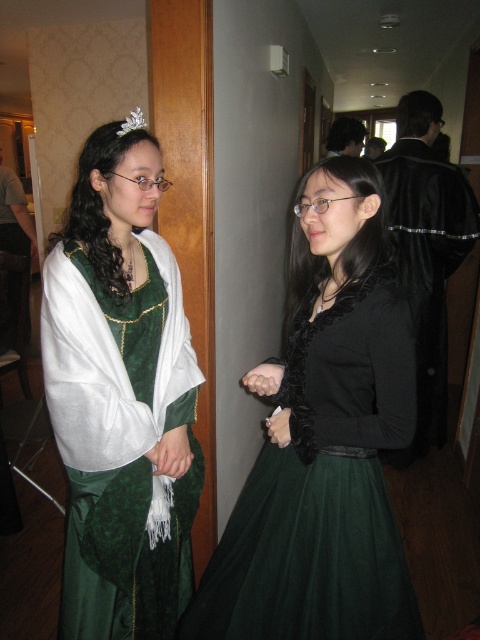
Is matte black blouse at center taller than black leather robe at right?

No.

Who is more forward, (376, 269) or (428, 186)?

Positioned in front is point (376, 269).

The width and height of the screenshot is (480, 640). I want to click on matte black blouse at center, so click(x=325, y=444).

What do you see at coordinates (325, 444) in the screenshot? The width and height of the screenshot is (480, 640). I see `matte black blouse at center` at bounding box center [325, 444].

Can you confirm if matte black blouse at center is taller than silver metallic tiara at upper left?

Yes, matte black blouse at center is taller than silver metallic tiara at upper left.

Is point (406, 604) more distant than point (143, 120)?

No, (406, 604) is in front of (143, 120).

Locate an element on the screen. The height and width of the screenshot is (640, 480). matte black blouse at center is located at coordinates (325, 444).

Is point (244, 376) closer to viewer compared to point (124, 131)?

No, it is not.

Between smooth skin hand at center and silver metallic tiara at upper left, which one is positioned lower?

smooth skin hand at center is lower down.

Who is more forward, (274, 369) or (134, 120)?

Point (134, 120)

At what (x,y) coordinates should I click in order to perform the action: click on smooth skin hand at center. Please return your answer as a coordinate pair (x, y). The width and height of the screenshot is (480, 640). Looking at the image, I should click on (264, 378).